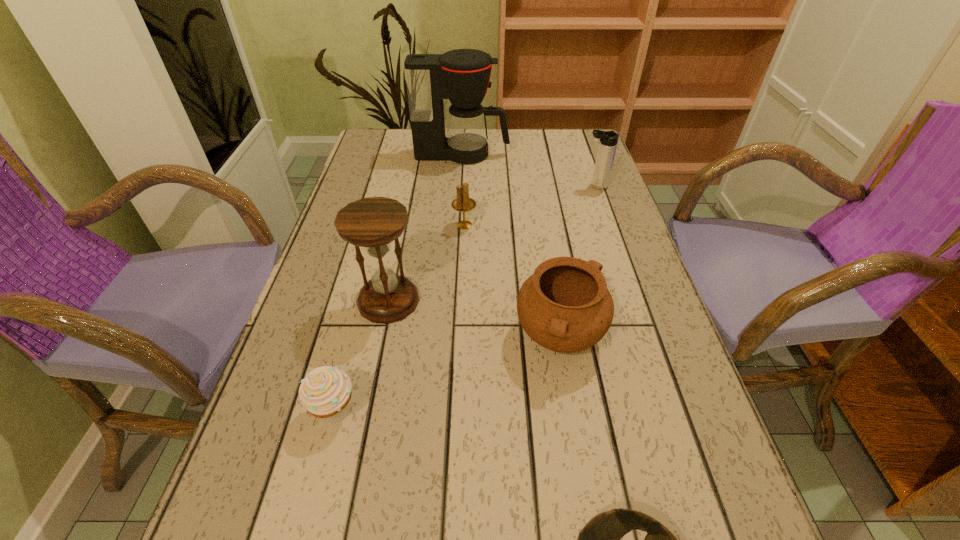
You are a GUI agent. You are given a task and a screenshot of the screen. Output one action in this format:
    pyautogui.click(x=<x>, y=<y>)
    Task: Click on the vacant area that lies between the second tallest object and the fifth nearest object
    
    Given the screenshot: What is the action you would take?
    pyautogui.click(x=426, y=263)

At what (x,y) coordinates should I click in order to perform the action: click on vacant area that lies between the sixth farthest object and the thermos bottle. Please return your answer as a coordinate pair (x, y). Image resolution: width=960 pixels, height=540 pixels. Looking at the image, I should click on (466, 299).

You are a GUI agent. You are given a task and a screenshot of the screen. Output one action in this format:
    pyautogui.click(x=<x>, y=<y>)
    Task: Click on the empty location between the sixth tallest object and the second tallest object
    
    Given the screenshot: What is the action you would take?
    pyautogui.click(x=362, y=356)

Image resolution: width=960 pixels, height=540 pixels. What are the coordinates of `free spot between the pottery and the tallest object` in the screenshot? It's located at (511, 246).

Locate which object is the second closest to the hourglass. Please provide its 2D coordinates. Your answer should be formatted as a tuple, i.e. [(x, y)], where the tuple contains the x and y coordinates of a point satisfying the conditions above.

[(462, 203)]

The width and height of the screenshot is (960, 540). What are the coordinates of `object that is the second closest to the coffee maker` in the screenshot? It's located at tap(462, 203).

You are a GUI agent. You are given a task and a screenshot of the screen. Output one action in this format:
    pyautogui.click(x=<x>, y=<y>)
    Task: Click on the vacant area that satisfies the following two spatial constraints: 1. on the back side of the pottery; 2. pour from the carafe of the tallest object
    
    Given the screenshot: What is the action you would take?
    pyautogui.click(x=530, y=154)

I want to click on free point that satisfies the following two spatial constraints: 1. on the front side of the third farthest object; 2. on the right side of the pottery, so click(460, 337).

You are a GUI agent. You are given a task and a screenshot of the screen. Output one action in this format:
    pyautogui.click(x=<x>, y=<y>)
    Task: Click on the vacant region that satisfies the following two spatial constraints: 1. on the back side of the hourglass; 2. on the right side of the candle holder
    
    Given the screenshot: What is the action you would take?
    pyautogui.click(x=404, y=225)

The height and width of the screenshot is (540, 960). In order to click on free location that satisfies the following two spatial constraints: 1. on the handle side of the rightmost object; 2. on the front side of the third farthest object in this screenshot , I will do `click(609, 225)`.